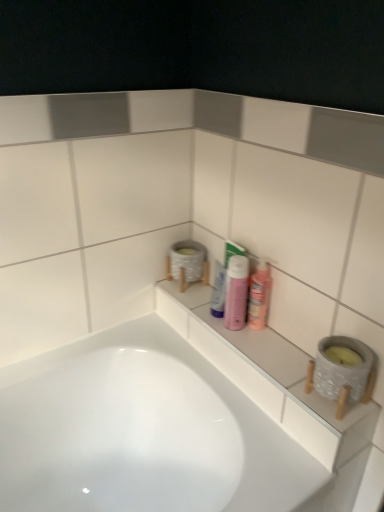
Find the location of a particular element. The width and height of the screenshot is (384, 512). free space in front of pink matte bottle at center is located at coordinates (259, 352).